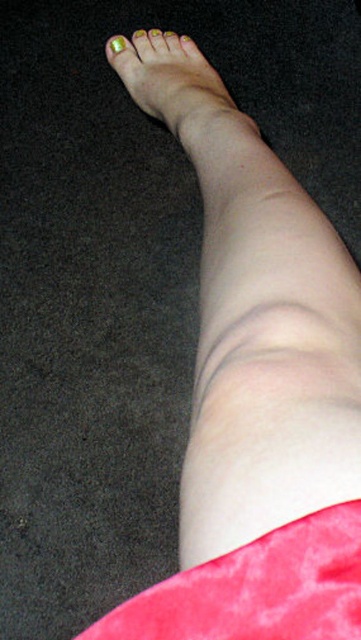
Based on the photo, how far apart are metallic gold nail polish at center and gold metallic nail at upper left?

19.50 centimeters

Who is lower down, metallic gold nail polish at center or gold metallic nail at upper left?

metallic gold nail polish at center is below.

Identify the location of metallic gold nail polish at center. (171, 80).

Between pink velvety fabric at lower right and yellow matte nail at upper left, which one appears on the left side from the viewer's perspective?

Positioned to the left is yellow matte nail at upper left.

Is pink velvety fabric at lower right positioned in front of yellow matte nail at upper left?

Yes, it is.

The image size is (361, 640). What do you see at coordinates (258, 588) in the screenshot?
I see `pink velvety fabric at lower right` at bounding box center [258, 588].

Locate an element on the screen. The image size is (361, 640). pink velvety fabric at lower right is located at coordinates (258, 588).

Which is above, smooth skin leg at center or green matte nail polish at upper left?

green matte nail polish at upper left

The height and width of the screenshot is (640, 361). I want to click on smooth skin leg at center, so click(x=255, y=320).